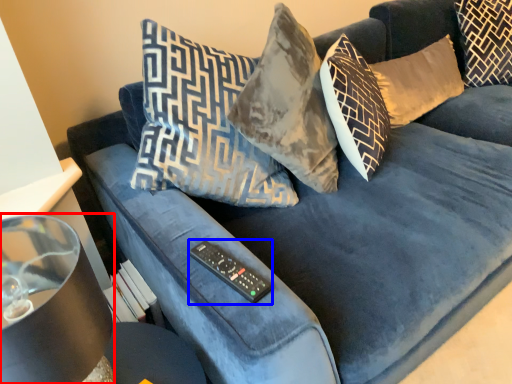
Question: Which object is closer to the camera taking this photo, lamp (highlighted by a red box) or remote (highlighted by a blue box)?

Choices:
 (A) lamp
 (B) remote

Answer: (A)